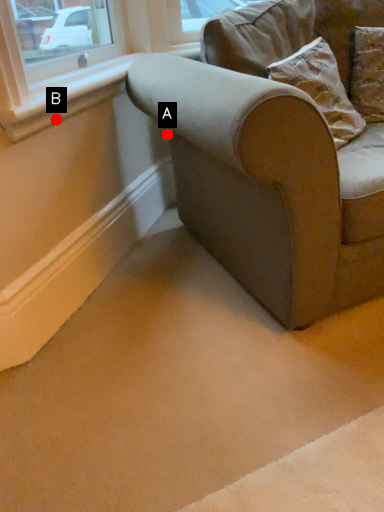
Question: Two points are circled on the image, labeled by A and B beside each circle. Which point appears closest to the camera in this image?

Choices:
 (A) A is closer
 (B) B is closer

Answer: (B)